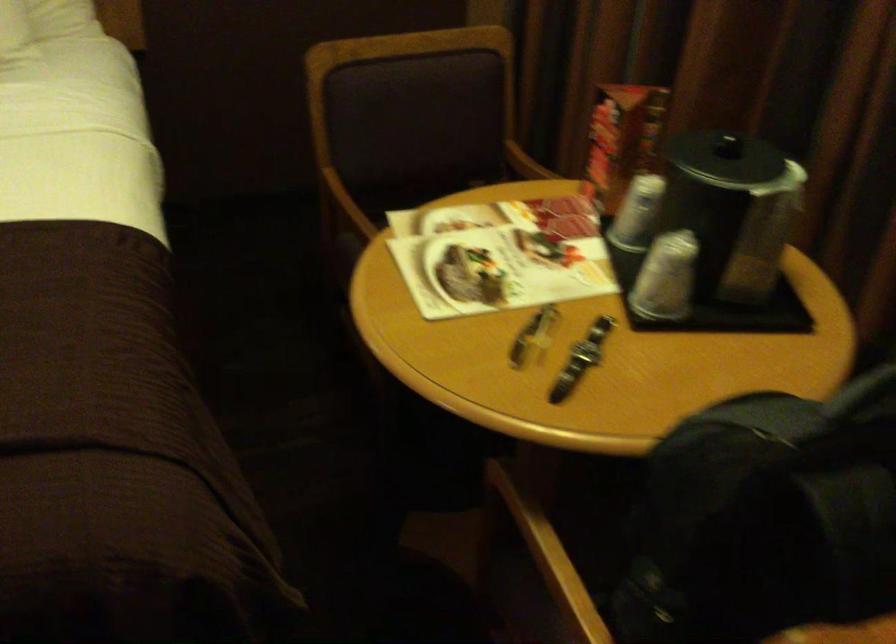
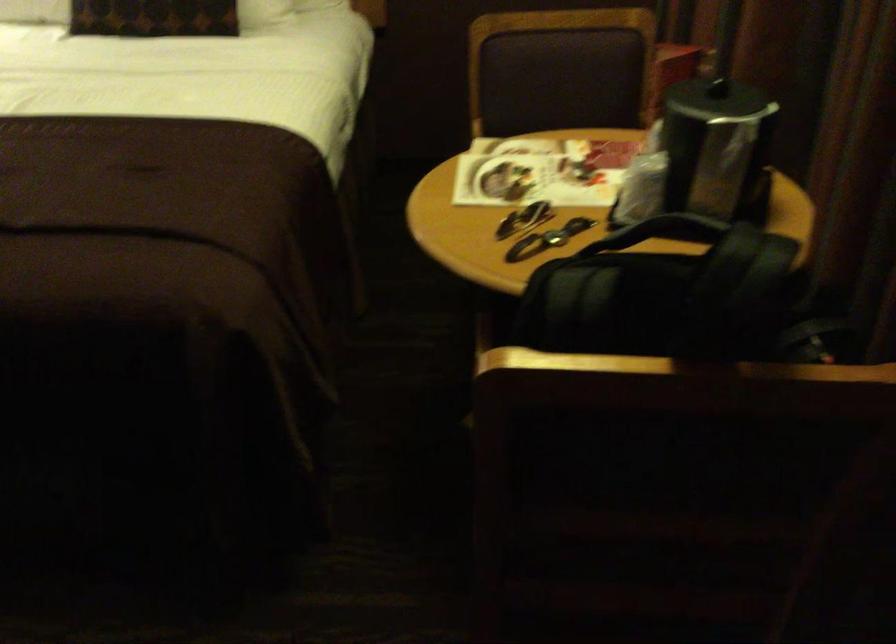
In the second image, find the point that corresponds to [751,225] in the first image.

(717, 149)